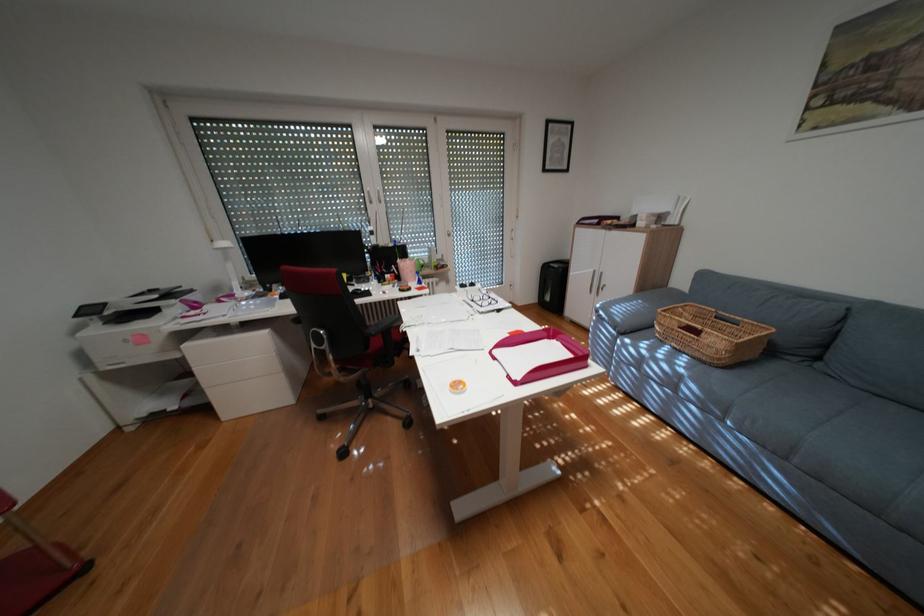
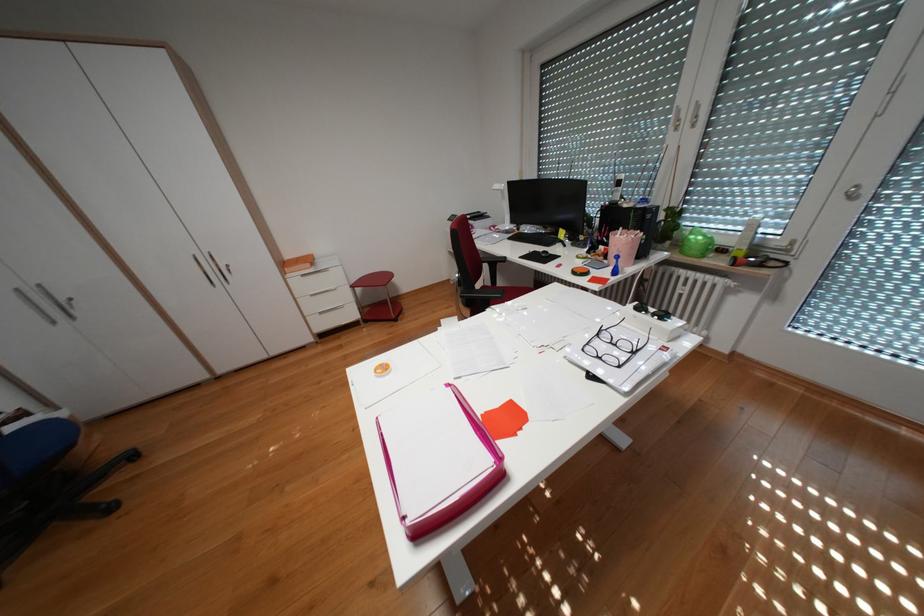
Locate, in the second image, the point that corresponds to (x=410, y=277) in the first image.

(618, 254)